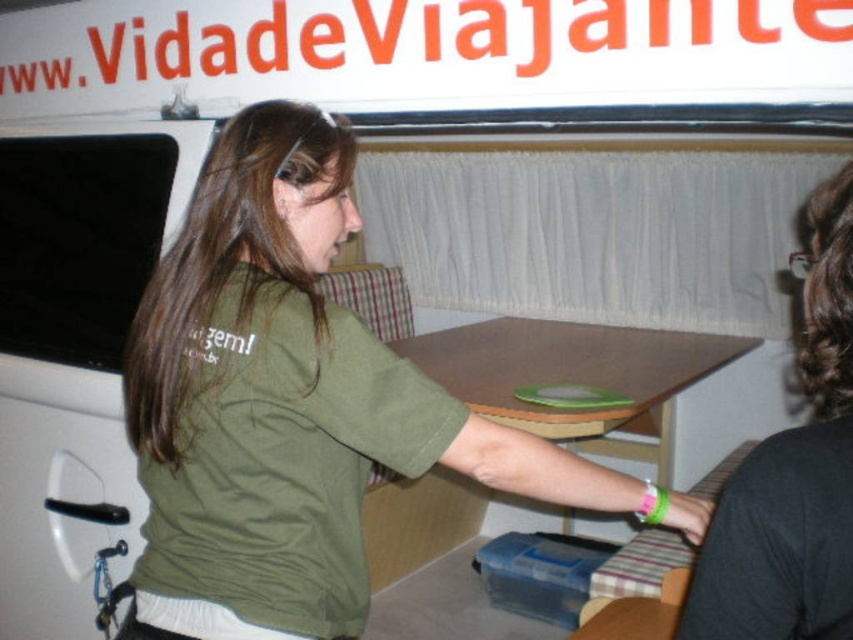
Can you confirm if green matte shirt at center is shorter than brown wooden table at center?

Incorrect, green matte shirt at center's height does not fall short of brown wooden table at center's.

Is green matte shirt at center further to the viewer compared to brown wooden table at center?

That is False.

Is point (244, 310) positioned before point (448, 337)?

Yes, point (244, 310) is in front of point (448, 337).

The height and width of the screenshot is (640, 853). I want to click on green matte shirt at center, so click(294, 404).

Is green matte shirt at center thinner than black matte shirt at upper right?

No.

Measure the distance from green matte shirt at center to black matte shirt at upper right.

A distance of 20.83 inches exists between green matte shirt at center and black matte shirt at upper right.

Between point (640, 516) and point (836, 529), which one is positioned in front?

Positioned in front is point (836, 529).

Locate an element on the screen. This screenshot has width=853, height=640. green matte shirt at center is located at coordinates (294, 404).

Is black matte shirt at upper right to the left of brown wooden table at center from the viewer's perspective?

Yes, black matte shirt at upper right is to the left of brown wooden table at center.

Who is more distant from viewer, (792, 435) or (631, 404)?

Positioned behind is point (631, 404).

What do you see at coordinates (792, 474) in the screenshot? Image resolution: width=853 pixels, height=640 pixels. I see `black matte shirt at upper right` at bounding box center [792, 474].

Identify the location of black matte shirt at upper right. (792, 474).